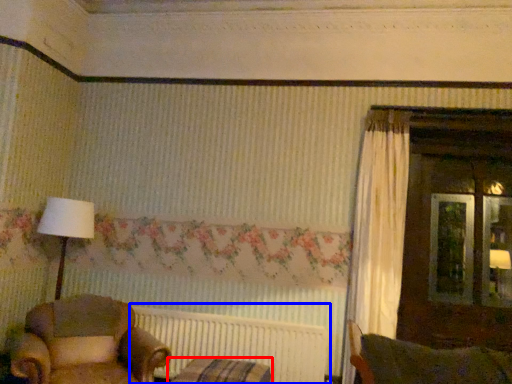
Question: Which object appears closest to the camera in this image, furniture (highlighted by a red box) or radiator (highlighted by a blue box)?

Choices:
 (A) furniture
 (B) radiator

Answer: (A)